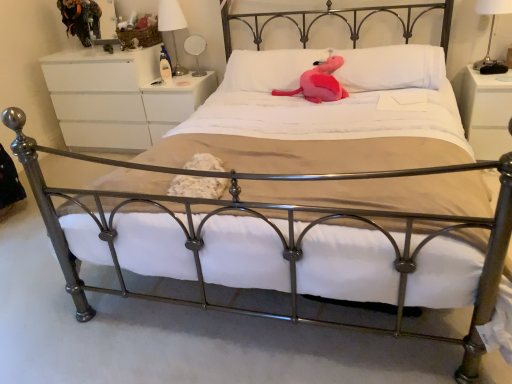
Describe the element at coordinates (486, 112) in the screenshot. I see `white glossy nightstand at right, which is counted as the first nightstand, starting from the right` at that location.

The height and width of the screenshot is (384, 512). What do you see at coordinates (268, 69) in the screenshot?
I see `pink plush at center, the first pillow from the left` at bounding box center [268, 69].

Find the location of a particular element. white matte dresser at upper left, positioned as the 3th nightstand in right-to-left order is located at coordinates (118, 98).

What is the approximate width of white fabric lampshade at upper right, acting as the 2th bedside lamp starting from the back?

white fabric lampshade at upper right, acting as the 2th bedside lamp starting from the back, is 22.13 centimeters in width.

Locate an element on the screen. white glossy lampshade at upper center, placed as the 2th bedside lamp when sorted from front to back is located at coordinates (172, 26).

Where is `pink plush at center, the 1th pillow from the right`? pink plush at center, the 1th pillow from the right is located at coordinates (391, 68).

Describe the element at coordinates (391, 68) in the screenshot. The height and width of the screenshot is (384, 512). I see `pink plush at center, placed as the second pillow when sorted from left to right` at that location.

Locate an element on the screen. white glossy nightstand at right, which is counted as the first nightstand, starting from the right is located at coordinates (486, 112).

Does point (440, 53) appear closer or farther from the camera than point (63, 105)?

Point (440, 53) appears to be closer to the viewer than point (63, 105).

Would you say white matte dresser at upper left, positioned as the 3th nightstand in right-to-left order, is part of pink plush at center, placed as the second pillow when sorted from left to right,'s contents?

No, pink plush at center, placed as the second pillow when sorted from left to right, does not contain white matte dresser at upper left, positioned as the 3th nightstand in right-to-left order.

Consider the image. Which is more to the right, pink plush at center, the 1th pillow from the right, or white matte dresser at upper left, positioned as the 3th nightstand in right-to-left order?

pink plush at center, the 1th pillow from the right, is more to the right.

Could you tell me if pink plush at center, the 1th pillow from the right, is turned towards white matte dresser at upper left, positioned as the 3th nightstand in right-to-left order?

No, pink plush at center, the 1th pillow from the right, is not turned towards white matte dresser at upper left, positioned as the 3th nightstand in right-to-left order.

Is white glossy lampshade at upper center, arranged as the first bedside lamp when viewed from the left, aimed at pink plush at center, the first pillow from the left?

No.

Which of these two, white glossy lampshade at upper center, placed as the second bedside lamp when sorted from right to left, or pink plush at center, the 2th pillow viewed from the right, is thinner?

white glossy lampshade at upper center, placed as the second bedside lamp when sorted from right to left, is thinner.

Would you say white glossy lampshade at upper center, placed as the 2th bedside lamp when sorted from front to back, is inside or outside pink plush at center, the first pillow from the left?

white glossy lampshade at upper center, placed as the 2th bedside lamp when sorted from front to back, cannot be found inside pink plush at center, the first pillow from the left.

From the image's perspective, relative to pink plush at center, the first pillow from the left, is white glossy lampshade at upper center, acting as the 1th bedside lamp starting from the back, above or below?

Clearly, from the image's perspective, white glossy lampshade at upper center, acting as the 1th bedside lamp starting from the back, is above pink plush at center, the first pillow from the left.

Is white matte dresser at upper left, which is the first nightstand in left-to-right order, wider than white glossy nightstand at center, which is counted as the second nightstand, starting from the left?

Indeed, white matte dresser at upper left, which is the first nightstand in left-to-right order, has a greater width compared to white glossy nightstand at center, which is counted as the second nightstand, starting from the left.

How much distance is there between white matte dresser at upper left, positioned as the 3th nightstand in right-to-left order, and white glossy nightstand at center, which is counted as the second nightstand, starting from the left?

white matte dresser at upper left, positioned as the 3th nightstand in right-to-left order, and white glossy nightstand at center, which is counted as the second nightstand, starting from the left, are 8.00 inches apart.

Where is `nightstand above the white glossy nightstand at center, which is counted as the 2th nightstand, starting from the right (from the image's perspective)`? Image resolution: width=512 pixels, height=384 pixels. nightstand above the white glossy nightstand at center, which is counted as the 2th nightstand, starting from the right (from the image's perspective) is located at coordinates (118, 98).

From the image's perspective, between white matte dresser at upper left, positioned as the 3th nightstand in right-to-left order, and white glossy nightstand at center, which is counted as the 2th nightstand, starting from the right, which one is located above?

white matte dresser at upper left, positioned as the 3th nightstand in right-to-left order, is shown above in the image.

Considering the relative sizes of pink plush at center, placed as the second pillow when sorted from left to right, and white glossy lampshade at upper center, placed as the 2th bedside lamp when sorted from front to back, in the image provided, is pink plush at center, placed as the second pillow when sorted from left to right, smaller than white glossy lampshade at upper center, placed as the 2th bedside lamp when sorted from front to back,?

Incorrect, pink plush at center, placed as the second pillow when sorted from left to right, is not smaller in size than white glossy lampshade at upper center, placed as the 2th bedside lamp when sorted from front to back.

Is pink plush at center, placed as the second pillow when sorted from left to right, far away from white glossy lampshade at upper center, arranged as the first bedside lamp when viewed from the left?

That's right, there is a large distance between pink plush at center, placed as the second pillow when sorted from left to right, and white glossy lampshade at upper center, arranged as the first bedside lamp when viewed from the left.

Could white glossy lampshade at upper center, acting as the 1th bedside lamp starting from the back, be considered to be inside pink plush at center, placed as the second pillow when sorted from left to right?

No, white glossy lampshade at upper center, acting as the 1th bedside lamp starting from the back, is located outside of pink plush at center, placed as the second pillow when sorted from left to right.

Could you measure the distance between pink plush at center, the 1th pillow from the right, and white glossy lampshade at upper center, placed as the second bedside lamp when sorted from right to left?

pink plush at center, the 1th pillow from the right, and white glossy lampshade at upper center, placed as the second bedside lamp when sorted from right to left, are 1.13 meters apart from each other.

From a real-world perspective, is white glossy lampshade at upper center, arranged as the first bedside lamp when viewed from the left, physically below white matte dresser at upper left, which is the first nightstand in left-to-right order?

Incorrect, from a real-world perspective, white glossy lampshade at upper center, arranged as the first bedside lamp when viewed from the left, is higher than white matte dresser at upper left, which is the first nightstand in left-to-right order.

From the image's perspective, who appears lower, white glossy lampshade at upper center, acting as the 1th bedside lamp starting from the back, or white matte dresser at upper left, positioned as the 3th nightstand in right-to-left order?

white matte dresser at upper left, positioned as the 3th nightstand in right-to-left order, appears lower in the image.

Is white glossy lampshade at upper center, arranged as the first bedside lamp when viewed from the left, to the left of white matte dresser at upper left, which is the first nightstand in left-to-right order, from the viewer's perspective?

Incorrect, white glossy lampshade at upper center, arranged as the first bedside lamp when viewed from the left, is not on the left side of white matte dresser at upper left, which is the first nightstand in left-to-right order.

In terms of height, does white glossy lampshade at upper center, placed as the 2th bedside lamp when sorted from front to back, look taller or shorter compared to white matte dresser at upper left, positioned as the 3th nightstand in right-to-left order?

Clearly, white glossy lampshade at upper center, placed as the 2th bedside lamp when sorted from front to back, is shorter compared to white matte dresser at upper left, positioned as the 3th nightstand in right-to-left order.

Is pink plush toy at center facing away from white glossy lampshade at upper center, arranged as the first bedside lamp when viewed from the left?

No.

Consider the image. From the image's perspective, is pink plush toy at center above or below white glossy lampshade at upper center, acting as the 1th bedside lamp starting from the back?

pink plush toy at center is below white glossy lampshade at upper center, acting as the 1th bedside lamp starting from the back.

Is pink plush toy at center directly adjacent to white glossy lampshade at upper center, placed as the 2th bedside lamp when sorted from front to back?

No, pink plush toy at center is not beside white glossy lampshade at upper center, placed as the 2th bedside lamp when sorted from front to back.

You are a GUI agent. You are given a task and a screenshot of the screen. Output one action in this format:
    pyautogui.click(x=<x>, y=<y>)
    Task: Click on the animal in front of the white glossy lampshade at upper center, placed as the 2th bedside lamp when sorted from front to back
    
    Given the screenshot: What is the action you would take?
    pyautogui.click(x=319, y=82)

Can you confirm if pink plush at center, placed as the second pillow when sorted from left to right, is wider than pink plush toy at center?

No, pink plush at center, placed as the second pillow when sorted from left to right, is not wider than pink plush toy at center.

Who is smaller, pink plush at center, placed as the second pillow when sorted from left to right, or pink plush toy at center?

With smaller size is pink plush toy at center.

Does point (397, 70) come closer to viewer compared to point (326, 71)?

Yes, point (397, 70) is closer to viewer.

From the image's perspective, which is above, pink plush at center, the 1th pillow from the right, or pink plush toy at center?

pink plush at center, the 1th pillow from the right, appears higher in the image.

Identify the location of the 2nd nightstand counting from the left of the pink plush at center, placed as the second pillow when sorted from left to right. (118, 98).

From the image's perspective, which pillow is the 1st one below the white glossy lampshade at upper center, placed as the 2th bedside lamp when sorted from front to back? Please provide its 2D coordinates.

[(268, 69)]

Based on their spatial positions, is white matte dresser at upper left, which is the first nightstand in left-to-right order, or pink plush toy at center further from white glossy lampshade at upper center, arranged as the first bedside lamp when viewed from the left?

Based on the image, pink plush toy at center appears to be further to white glossy lampshade at upper center, arranged as the first bedside lamp when viewed from the left.

Looking at the image, which one is located further to white fabric lampshade at upper right, positioned as the 1th bedside lamp in front-to-back order, white glossy nightstand at center, which is counted as the 2th nightstand, starting from the right, or white glossy nightstand at right, which is counted as the first nightstand, starting from the right?

Among the two, white glossy nightstand at center, which is counted as the 2th nightstand, starting from the right, is located further to white fabric lampshade at upper right, positioned as the 1th bedside lamp in front-to-back order.

When comparing their distances from pink plush at center, the first pillow from the left, does white fabric lampshade at upper right, positioned as the 1th bedside lamp in front-to-back order, or white glossy nightstand at center, which is counted as the 2th nightstand, starting from the right, seem closer?

Among the two, white glossy nightstand at center, which is counted as the 2th nightstand, starting from the right, is located nearer to pink plush at center, the first pillow from the left.

In the scene shown: Estimate the real-world distances between objects in this image. Which object is closer to pink plush at center, the 1th pillow from the right, white glossy lampshade at upper center, acting as the 1th bedside lamp starting from the back, or white glossy nightstand at right, which is counted as the first nightstand, starting from the right?

Among the two, white glossy nightstand at right, which is counted as the first nightstand, starting from the right, is located nearer to pink plush at center, the 1th pillow from the right.

Which object lies further to the anchor point white matte dresser at upper left, which is the first nightstand in left-to-right order, pink plush toy at center or white glossy nightstand at center, which is counted as the 2th nightstand, starting from the right?

pink plush toy at center is positioned further to the anchor white matte dresser at upper left, which is the first nightstand in left-to-right order.

Estimate the real-world distances between objects in this image. Which object is closer to white fabric lampshade at upper right, arranged as the second bedside lamp when viewed from the left, pink plush at center, placed as the second pillow when sorted from left to right, or white glossy lampshade at upper center, placed as the second bedside lamp when sorted from right to left?

Among the two, pink plush at center, placed as the second pillow when sorted from left to right, is located nearer to white fabric lampshade at upper right, arranged as the second bedside lamp when viewed from the left.

When comparing their distances from white matte dresser at upper left, which is the first nightstand in left-to-right order, does white fabric lampshade at upper right, acting as the 2th bedside lamp starting from the back, or white glossy lampshade at upper center, placed as the second bedside lamp when sorted from right to left, seem closer?

white glossy lampshade at upper center, placed as the second bedside lamp when sorted from right to left.

When comparing their distances from white matte dresser at upper left, positioned as the 3th nightstand in right-to-left order, does white glossy lampshade at upper center, acting as the 1th bedside lamp starting from the back, or pink plush toy at center seem closer?

white glossy lampshade at upper center, acting as the 1th bedside lamp starting from the back, lies closer to white matte dresser at upper left, positioned as the 3th nightstand in right-to-left order, than the other object.

At what (x,y) coordinates should I click in order to perform the action: click on bedside lamp between white glossy lampshade at upper center, placed as the second bedside lamp when sorted from right to left, and white glossy nightstand at right, which appears as the third nightstand when viewed from the left, from left to right. Please return your answer as a coordinate pair (x, y). Looking at the image, I should click on (492, 34).

At what (x,y) coordinates should I click in order to perform the action: click on pillow between white glossy lampshade at upper center, arranged as the first bedside lamp when viewed from the left, and pink plush at center, the 1th pillow from the right. Please return your answer as a coordinate pair (x, y). Image resolution: width=512 pixels, height=384 pixels. Looking at the image, I should click on (268, 69).

The width and height of the screenshot is (512, 384). What are the coordinates of `pillow between white matte dresser at upper left, which is the first nightstand in left-to-right order, and pink plush at center, placed as the second pillow when sorted from left to right, in the horizontal direction` in the screenshot? It's located at (268, 69).

Find the location of a particular element. pillow between white glossy lampshade at upper center, placed as the second bedside lamp when sorted from right to left, and pink plush toy at center, in the horizontal direction is located at coordinates (268, 69).